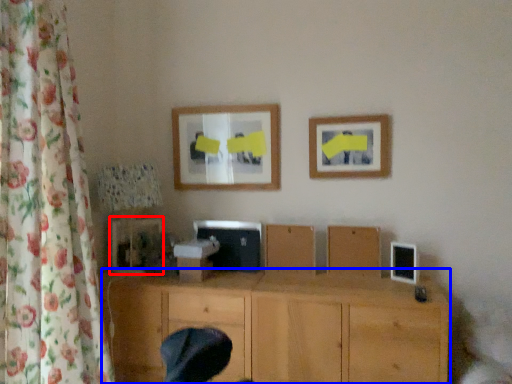
Question: Which of the following is the closest to the observer, picture frame (highlighted by a red box) or wood (highlighted by a blue box)?

Choices:
 (A) picture frame
 (B) wood

Answer: (B)